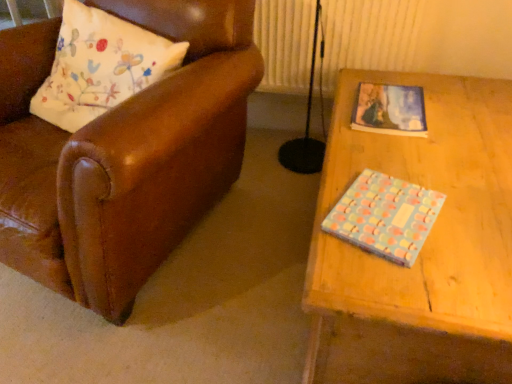
The image size is (512, 384). I want to click on vacant area on top of pastel polka dot book at right, positioned as the first book in front-to-back order (from a real-world perspective), so click(x=383, y=212).